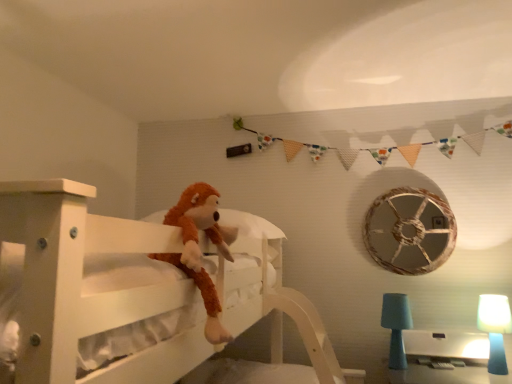
Question: Can you confirm if blue matte table lamp at lower right, the second table lamp positioned from the left, is positioned to the left of teal fabric lampshade at lower right, marked as the 2th table lamp in a right-to-left arrangement?

Choices:
 (A) yes
 (B) no

Answer: (B)

Question: From a real-world perspective, is blue matte table lamp at lower right, positioned as the 1th table lamp in right-to-left order, positioned over teal fabric lampshade at lower right, marked as the 2th table lamp in a right-to-left arrangement, based on gravity?

Choices:
 (A) no
 (B) yes

Answer: (A)

Question: Is blue matte table lamp at lower right, the second table lamp positioned from the left, closer to the viewer compared to teal fabric lampshade at lower right, the 1th table lamp from the left?

Choices:
 (A) yes
 (B) no

Answer: (A)

Question: From a real-world perspective, does blue matte table lamp at lower right, the second table lamp positioned from the left, sit lower than teal fabric lampshade at lower right, the 1th table lamp from the left?

Choices:
 (A) yes
 (B) no

Answer: (A)

Question: Considering the relative positions of blue matte table lamp at lower right, positioned as the 1th table lamp in right-to-left order, and teal fabric lampshade at lower right, the 1th table lamp from the left, in the image provided, is blue matte table lamp at lower right, positioned as the 1th table lamp in right-to-left order, behind teal fabric lampshade at lower right, the 1th table lamp from the left,?

Choices:
 (A) yes
 (B) no

Answer: (B)

Question: Considering the relative sizes of blue matte table lamp at lower right, positioned as the 1th table lamp in right-to-left order, and teal fabric lampshade at lower right, marked as the 2th table lamp in a right-to-left arrangement, in the image provided, is blue matte table lamp at lower right, positioned as the 1th table lamp in right-to-left order, wider than teal fabric lampshade at lower right, marked as the 2th table lamp in a right-to-left arrangement,?

Choices:
 (A) no
 (B) yes

Answer: (A)

Question: Are brown plush toy at center and rustic wood wheel at upper right located far from each other?

Choices:
 (A) no
 (B) yes

Answer: (B)

Question: Does brown plush toy at center touch rustic wood wheel at upper right?

Choices:
 (A) yes
 (B) no

Answer: (B)

Question: Is rustic wood wheel at upper right at the back of brown plush toy at center?

Choices:
 (A) yes
 (B) no

Answer: (B)

Question: Is brown plush toy at center thinner than rustic wood wheel at upper right?

Choices:
 (A) yes
 (B) no

Answer: (B)

Question: Can you confirm if brown plush toy at center is smaller than rustic wood wheel at upper right?

Choices:
 (A) no
 (B) yes

Answer: (A)

Question: Can we say brown plush toy at center lies outside rustic wood wheel at upper right?

Choices:
 (A) no
 (B) yes

Answer: (B)

Question: Is blue matte table lamp at lower right, the second table lamp positioned from the left, facing away from brown plush toy at center?

Choices:
 (A) yes
 (B) no

Answer: (B)